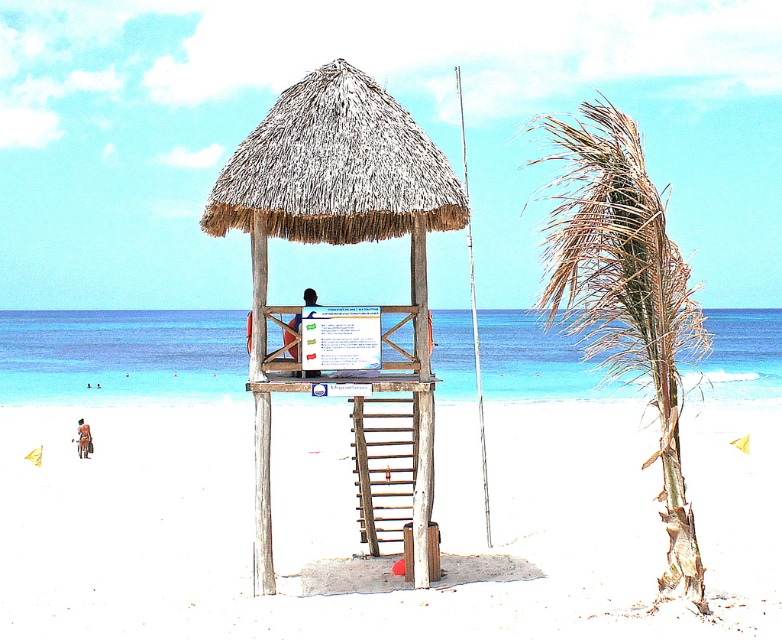
In the scene shown: You are a visitor at the beach and want to take a photo of the thatched wood hut at center and the wooden at center. Which one is positioned higher in the image?

The thatched wood hut at center is positioned higher than the wooden at center in the image.